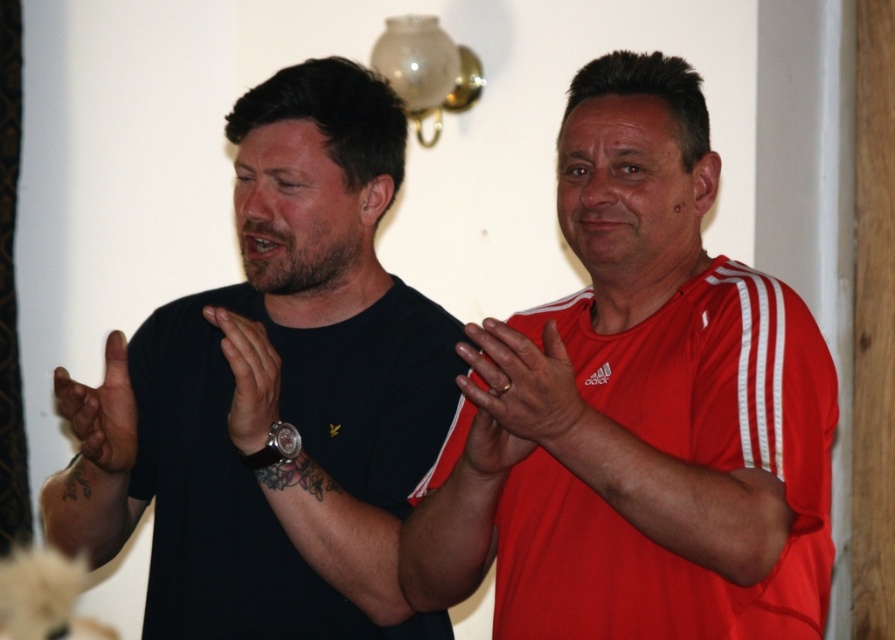
Question: Among these points, which one is farthest from the camera?

Choices:
 (A) (258, 292)
 (B) (732, 556)

Answer: (A)

Question: Among these points, which one is farthest from the camera?

Choices:
 (A) (122, 412)
 (B) (276, 360)

Answer: (A)

Question: Estimate the real-world distances between objects in this image. Which object is farther from the black matte wristwatch at left?

Choices:
 (A) gold metallic ring at center
 (B) black leather watch at center

Answer: (A)

Question: Considering the relative positions of black matte wristwatch at left and gold metallic ring at center in the image provided, where is black matte wristwatch at left located with respect to gold metallic ring at center?

Choices:
 (A) above
 (B) below

Answer: (B)

Question: Can you confirm if black matte t-shirt at left is positioned below black leather watch at center?

Choices:
 (A) no
 (B) yes

Answer: (A)

Question: Is red matte shirt at right positioned behind gold metallic ring at center?

Choices:
 (A) no
 (B) yes

Answer: (B)